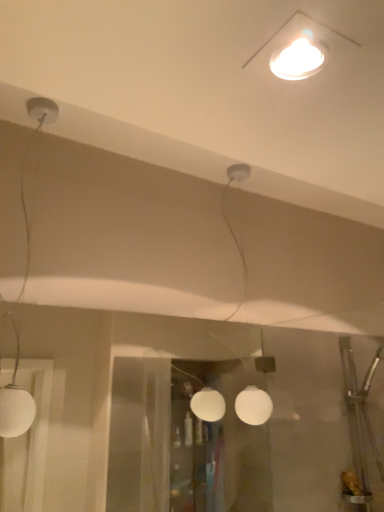
The height and width of the screenshot is (512, 384). I want to click on white matte globe lamp at left, which ranks as the 1th lamp in left-to-right order, so click(x=15, y=399).

Where is `white glossy light fixture at upper center, which appears as the third lamp when viewed from the left`? This screenshot has height=512, width=384. white glossy light fixture at upper center, which appears as the third lamp when viewed from the left is located at coordinates (300, 48).

I want to click on white matte globe at center, the 2th lamp from the left, so click(x=253, y=406).

Considering the points (30, 418) and (256, 388), which point is in front, point (30, 418) or point (256, 388)?

The point (30, 418) is more forward.

Can you confirm if white matte globe lamp at left, arranged as the second lamp when viewed from the back, is positioned to the right of white matte globe at center, which appears as the 2th lamp when viewed from the right?

No, white matte globe lamp at left, arranged as the second lamp when viewed from the back, is not to the right of white matte globe at center, which appears as the 2th lamp when viewed from the right.

Are white matte globe lamp at left, arranged as the second lamp when viewed from the back, and white matte globe at center, which is the 1th lamp from back to front, making contact?

They are not placed beside each other.

Is white matte globe lamp at left, which ranks as the 1th lamp in left-to-right order, outside of white matte globe at center, which appears as the 2th lamp when viewed from the right?

That's correct, white matte globe lamp at left, which ranks as the 1th lamp in left-to-right order, is outside of white matte globe at center, which appears as the 2th lamp when viewed from the right.

How many degrees apart are the facing directions of white matte globe at center, which is the 3th lamp from front to back, and white glossy light fixture at upper center, the 3th lamp viewed from the back?

There is a 0.0012-degree angle between the facing directions of white matte globe at center, which is the 3th lamp from front to back, and white glossy light fixture at upper center, the 3th lamp viewed from the back.

Would you say white matte globe at center, which is the 3th lamp from front to back, is to the left or to the right of white glossy light fixture at upper center, the 1th lamp from the front, in the picture?

white matte globe at center, which is the 3th lamp from front to back, is to the left of white glossy light fixture at upper center, the 1th lamp from the front.

Is white matte globe at center, which appears as the 2th lamp when viewed from the right, closer to camera compared to white glossy light fixture at upper center, which appears as the third lamp when viewed from the left?

No.

Is white matte globe at center, which is the 1th lamp from back to front, completely or partially outside of white glossy light fixture at upper center, the 1th lamp from the front?

Indeed, white matte globe at center, which is the 1th lamp from back to front, is completely outside white glossy light fixture at upper center, the 1th lamp from the front.

What's the angular difference between white glossy light fixture at upper center, marked as the first lamp in a right-to-left arrangement, and white matte globe lamp at left, the third lamp from the right,'s facing directions?

The angular difference between white glossy light fixture at upper center, marked as the first lamp in a right-to-left arrangement, and white matte globe lamp at left, the third lamp from the right, is 0.000381 degrees.

Can you confirm if white glossy light fixture at upper center, the 1th lamp from the front, is positioned to the right of white matte globe lamp at left, which is counted as the second lamp, starting from the front?

Yes.

Could you tell me if white glossy light fixture at upper center, the 3th lamp viewed from the back, is turned towards white matte globe lamp at left, which is counted as the second lamp, starting from the front?

No, white glossy light fixture at upper center, the 3th lamp viewed from the back, is not facing towards white matte globe lamp at left, which is counted as the second lamp, starting from the front.

From a real-world perspective, is white glossy light fixture at upper center, marked as the first lamp in a right-to-left arrangement, above or below white matte globe lamp at left, arranged as the second lamp when viewed from the back?

white glossy light fixture at upper center, marked as the first lamp in a right-to-left arrangement, is above white matte globe lamp at left, arranged as the second lamp when viewed from the back.

Does white glossy light fixture at upper center, marked as the first lamp in a right-to-left arrangement, have a greater width compared to white matte globe at center, the 2th lamp from the left?

Yes.

In the scene shown: Is white matte globe at center, the 2th lamp from the left, at the back of white glossy light fixture at upper center, the 1th lamp from the front?

No, white matte globe at center, the 2th lamp from the left, is not at the back of white glossy light fixture at upper center, the 1th lamp from the front.

Considering the relative sizes of white glossy light fixture at upper center, the 3th lamp viewed from the back, and white matte globe at center, which appears as the 2th lamp when viewed from the right, in the image provided, is white glossy light fixture at upper center, the 3th lamp viewed from the back, taller than white matte globe at center, which appears as the 2th lamp when viewed from the right,?

Incorrect, the height of white glossy light fixture at upper center, the 3th lamp viewed from the back, is not larger of that of white matte globe at center, which appears as the 2th lamp when viewed from the right.

Considering the positions of objects white glossy light fixture at upper center, the 3th lamp viewed from the back, and white matte globe at center, the 2th lamp from the left, in the image provided, who is more to the right, white glossy light fixture at upper center, the 3th lamp viewed from the back, or white matte globe at center, the 2th lamp from the left,?

Positioned to the right is white glossy light fixture at upper center, the 3th lamp viewed from the back.

Who is taller, white matte globe at center, which is the 1th lamp from back to front, or white matte globe lamp at left, which is counted as the second lamp, starting from the front?

With more height is white matte globe lamp at left, which is counted as the second lamp, starting from the front.

From the picture: Considering the relative positions of white matte globe at center, which appears as the 2th lamp when viewed from the right, and white matte globe lamp at left, which ranks as the 1th lamp in left-to-right order, in the image provided, is white matte globe at center, which appears as the 2th lamp when viewed from the right, in front of white matte globe lamp at left, which ranks as the 1th lamp in left-to-right order,?

No, white matte globe at center, which appears as the 2th lamp when viewed from the right, is further to the viewer.

From a real-world perspective, is white matte globe at center, which is the 1th lamp from back to front, above or below white matte globe lamp at left, which ranks as the 1th lamp in left-to-right order?

Clearly, from a real-world perspective, white matte globe at center, which is the 1th lamp from back to front, is below white matte globe lamp at left, which ranks as the 1th lamp in left-to-right order.

Does point (18, 402) come in front of point (320, 31)?

That is False.

Between white matte globe lamp at left, arranged as the second lamp when viewed from the back, and white glossy light fixture at upper center, the 1th lamp from the front, which one appears on the right side from the viewer's perspective?

From the viewer's perspective, white glossy light fixture at upper center, the 1th lamp from the front, appears more on the right side.

Is white matte globe lamp at left, arranged as the second lamp when viewed from the back, outside of white glossy light fixture at upper center, the 3th lamp viewed from the back?

white matte globe lamp at left, arranged as the second lamp when viewed from the back, lies outside white glossy light fixture at upper center, the 3th lamp viewed from the back,'s area.

You are a GUI agent. You are given a task and a screenshot of the screen. Output one action in this format:
    pyautogui.click(x=<x>, y=<y>)
    Task: Click on the lamp behind the white matte globe lamp at left, the third lamp from the right
    The image size is (384, 512).
    Given the screenshot: What is the action you would take?
    pyautogui.click(x=253, y=406)

You are a GUI agent. You are given a task and a screenshot of the screen. Output one action in this format:
    pyautogui.click(x=<x>, y=<y>)
    Task: Click on the 2nd lamp above when counting from the white matte globe at center, which appears as the 2th lamp when viewed from the right (from the image's perspective)
    
    Given the screenshot: What is the action you would take?
    pyautogui.click(x=300, y=48)

From the image, which object appears to be farther from white matte globe lamp at left, arranged as the second lamp when viewed from the back, white matte globe at center, which is the 3th lamp from front to back, or white glossy light fixture at upper center, the 3th lamp viewed from the back?

Among the two, white glossy light fixture at upper center, the 3th lamp viewed from the back, is located further to white matte globe lamp at left, arranged as the second lamp when viewed from the back.

From the image, which object appears to be farther from white matte globe at center, which appears as the 2th lamp when viewed from the right, white glossy light fixture at upper center, the 3th lamp viewed from the back, or white matte globe lamp at left, arranged as the second lamp when viewed from the back?

white matte globe lamp at left, arranged as the second lamp when viewed from the back, lies further to white matte globe at center, which appears as the 2th lamp when viewed from the right, than the other object.

Considering their positions, is white glossy light fixture at upper center, the 1th lamp from the front, positioned further to white matte globe lamp at left, which ranks as the 1th lamp in left-to-right order, than white matte globe at center, which appears as the 2th lamp when viewed from the right?

Based on the image, white glossy light fixture at upper center, the 1th lamp from the front, appears to be further to white matte globe lamp at left, which ranks as the 1th lamp in left-to-right order.

Which object lies further to the anchor point white glossy light fixture at upper center, marked as the first lamp in a right-to-left arrangement, white matte globe at center, which is the 3th lamp from front to back, or white matte globe lamp at left, the third lamp from the right?

Based on the image, white matte globe lamp at left, the third lamp from the right, appears to be further to white glossy light fixture at upper center, marked as the first lamp in a right-to-left arrangement.

When comparing their distances from white matte globe at center, which is the 1th lamp from back to front, does white matte globe lamp at left, arranged as the second lamp when viewed from the back, or white glossy light fixture at upper center, the 3th lamp viewed from the back, seem further?

white matte globe lamp at left, arranged as the second lamp when viewed from the back, is further to white matte globe at center, which is the 1th lamp from back to front.

Estimate the real-world distances between objects in this image. Which object is further from white glossy light fixture at upper center, the 3th lamp viewed from the back, white matte globe lamp at left, which is counted as the second lamp, starting from the front, or white matte globe at center, which is the 3th lamp from front to back?

Based on the image, white matte globe lamp at left, which is counted as the second lamp, starting from the front, appears to be further to white glossy light fixture at upper center, the 3th lamp viewed from the back.

At what (x,y) coordinates should I click in order to perform the action: click on lamp situated between white matte globe lamp at left, the third lamp from the right, and white glossy light fixture at upper center, which appears as the third lamp when viewed from the left, from left to right. Please return your answer as a coordinate pair (x, y). The height and width of the screenshot is (512, 384). Looking at the image, I should click on (253, 406).